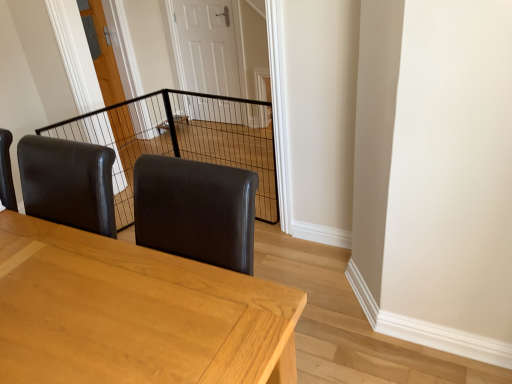
Find the location of a particular element. free spot above white glossy door at center, which appears as the second door when viewed from the left (from a real-world perspective) is located at coordinates (200, 1).